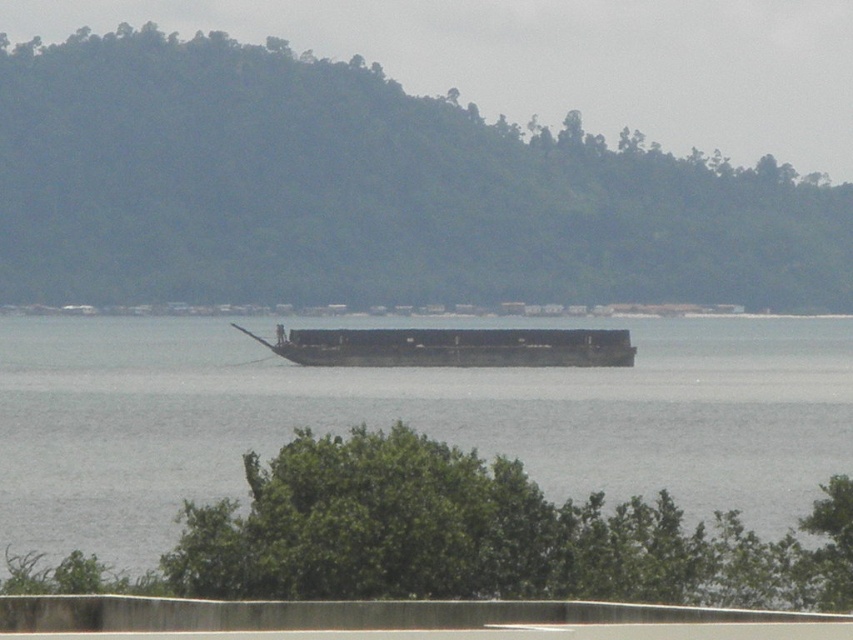
You are standing at the shore of the coastal scene and want to take a photo. There are two points in the image, point 1 at coordinates point (160, 40) and point 2 at coordinates point (508, 413). Which point will appear closer to you in the photo?

Point 1 at coordinates point (160, 40) will appear closer to you in the photo because it is further to the camera than point 2 at coordinates point (508, 413).

You are a photographer planning to capture the green forested hill at center and the dark gray metallic barge at center in a single frame. Which object will occupy more space in your photo?

The green forested hill at center is larger in size than the dark gray metallic barge at center, so it will occupy more space in the photo.

You are standing at the shore of the coastal scene and want to walk towards the forested hill in the background. There are two points marked on the path ahead of you. The first point is at coordinate point(656, 422) and the second point is at coordinate point(621, 364). Which point should you reach first while walking towards the hill?

Point(656, 422) is in front of point(621, 364), so you should reach point(656, 422) first while walking towards the hill.